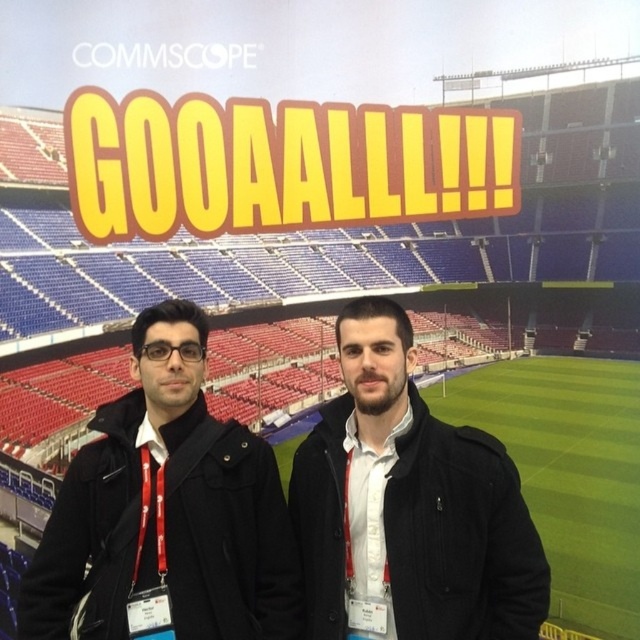
Question: Which object appears farthest from the camera in this image?

Choices:
 (A) matte black jacket at center
 (B) black matte jacket at center

Answer: (B)

Question: Is black matte jacket at center above matte black jacket at center?

Choices:
 (A) yes
 (B) no

Answer: (B)

Question: Can you confirm if black matte jacket at center is thinner than matte black jacket at center?

Choices:
 (A) yes
 (B) no

Answer: (B)

Question: Can you confirm if black matte jacket at center is positioned to the left of matte black jacket at center?

Choices:
 (A) no
 (B) yes

Answer: (B)

Question: Which point appears closest to the camera in this image?

Choices:
 (A) (531, 573)
 (B) (179, 353)

Answer: (A)